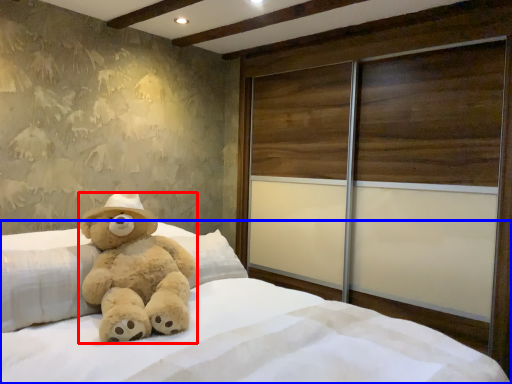
Question: Which object is further to the camera taking this photo, teddy bear (highlighted by a red box) or bed (highlighted by a blue box)?

Choices:
 (A) teddy bear
 (B) bed

Answer: (A)